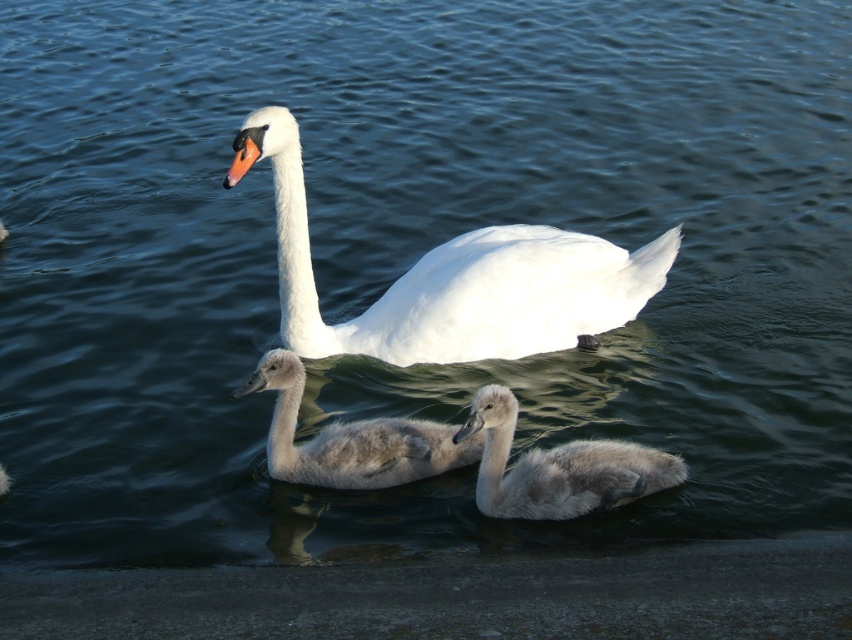
Question: Can you confirm if white glossy swan at center is positioned to the left of gray fluffy swan at center?

Choices:
 (A) yes
 (B) no

Answer: (A)

Question: Estimate the real-world distances between objects in this image. Which object is closer to the gray downy cygnet at center?

Choices:
 (A) white glossy swan at center
 (B) gray fluffy swan at center

Answer: (B)

Question: Which object appears farthest from the camera in this image?

Choices:
 (A) white glossy swan at center
 (B) gray downy cygnet at center

Answer: (A)

Question: Is white glossy swan at center smaller than gray fluffy swan at center?

Choices:
 (A) yes
 (B) no

Answer: (B)

Question: Which object is positioned farthest from the gray downy cygnet at center?

Choices:
 (A) gray fluffy swan at center
 (B) white glossy swan at center

Answer: (B)

Question: Does white glossy swan at center have a greater width compared to gray fluffy swan at center?

Choices:
 (A) no
 (B) yes

Answer: (B)